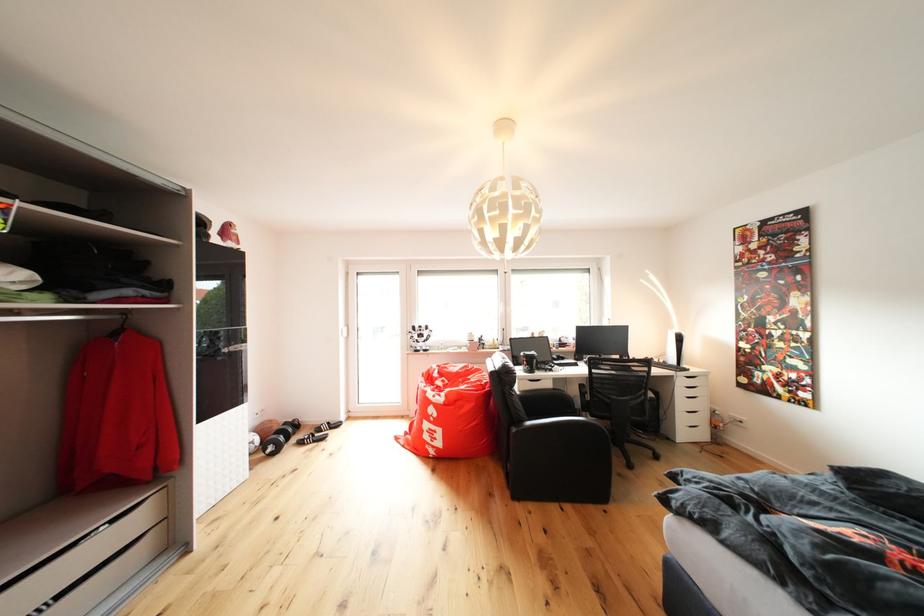
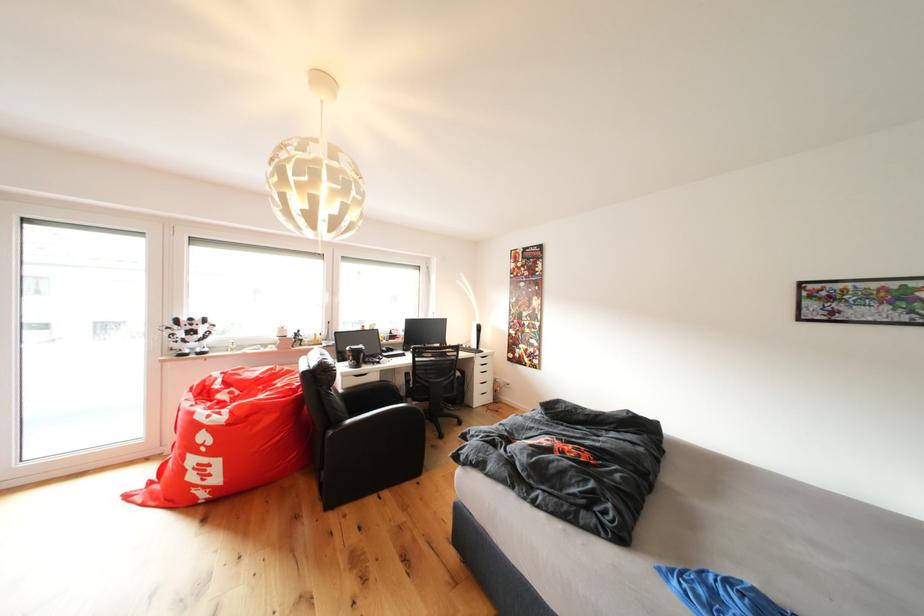
The point at (694,371) is marked in the first image. Where is the corresponding point in the second image?

(490, 354)